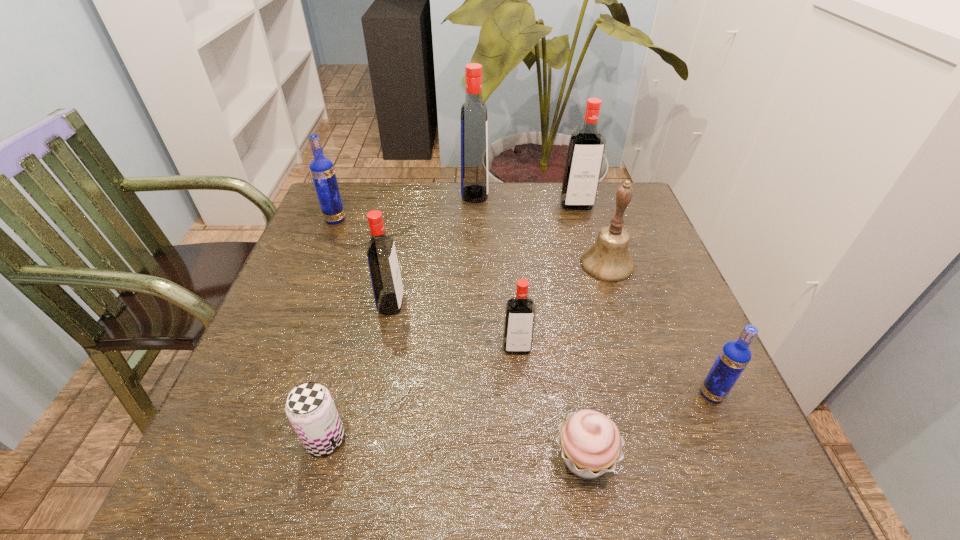
Find the location of a particular element. bell that is at the right edge is located at coordinates (608, 260).

In order to click on object located in the far left corner section of the desktop in this screenshot , I will do `click(322, 171)`.

At what (x,y) coordinates should I click in order to perform the action: click on object positioned at the near left corner. Please return your answer as a coordinate pair (x, y). This screenshot has height=540, width=960. Looking at the image, I should click on (310, 408).

At what (x,y) coordinates should I click in order to perform the action: click on object positioned at the far right corner. Please return your answer as a coordinate pair (x, y). Looking at the image, I should click on (586, 148).

In order to click on vacant space at the far edge of the desktop in this screenshot , I will do `click(450, 183)`.

Image resolution: width=960 pixels, height=540 pixels. Find the location of `vacant space at the left edge of the desktop`. vacant space at the left edge of the desktop is located at coordinates (220, 429).

Identify the location of vacant area at the right edge. This screenshot has width=960, height=540. (645, 241).

In the image, there is a desktop. Where is `vacant region at the far left corner`? This screenshot has height=540, width=960. vacant region at the far left corner is located at coordinates (370, 187).

In the image, there is a desktop. At what (x,y) coordinates should I click in order to perform the action: click on vacant space at the near left corner. Please return your answer as a coordinate pair (x, y). This screenshot has width=960, height=540. Looking at the image, I should click on coord(181,494).

In the image, there is a desktop. What are the coordinates of `free space at the far right corner` in the screenshot? It's located at (607, 193).